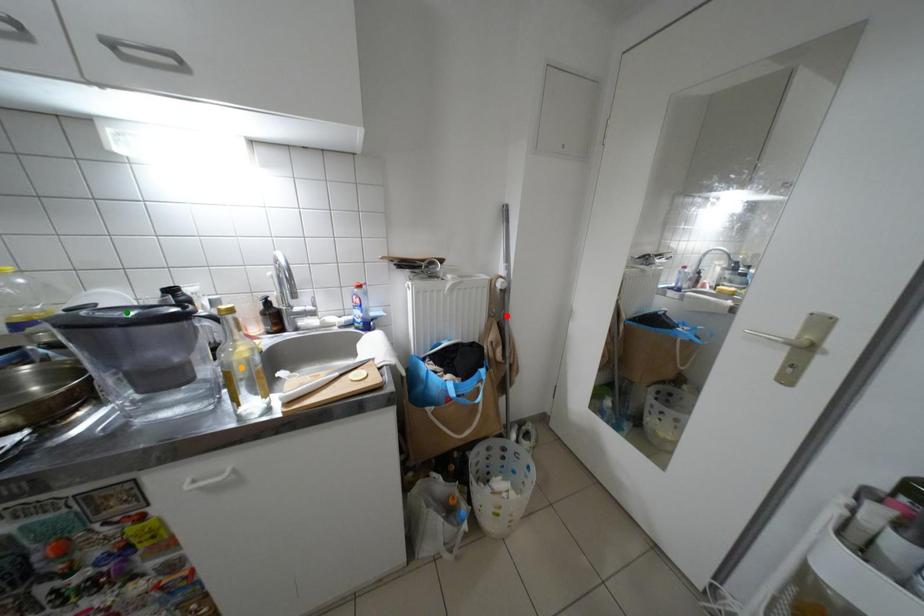
Order these from nearest to farthest:
A) green point
B) red point
C) orange point

1. green point
2. orange point
3. red point